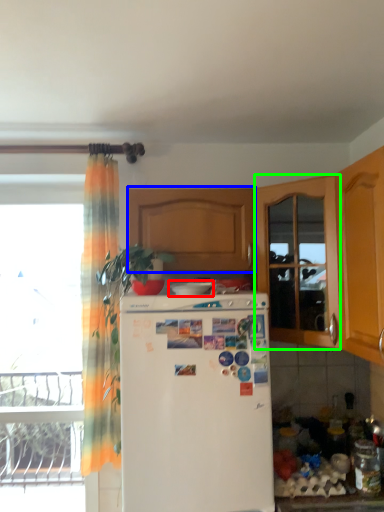
Question: Estimate the real-world distances between objects in this image. Which object is farther from appliance (highlighted by a red box), cabinetry (highlighted by a blue box) or screen door (highlighted by a green box)?

Choices:
 (A) cabinetry
 (B) screen door

Answer: (B)